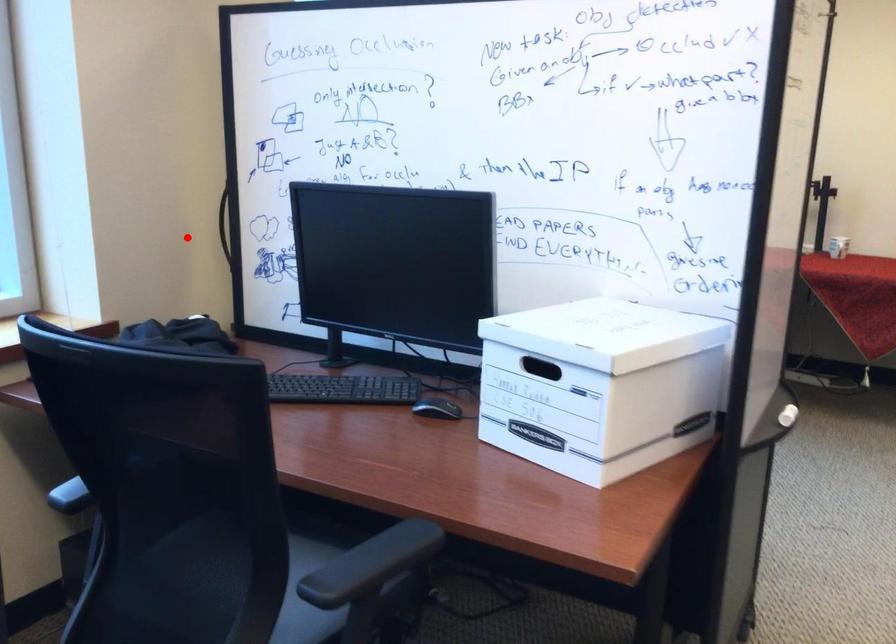
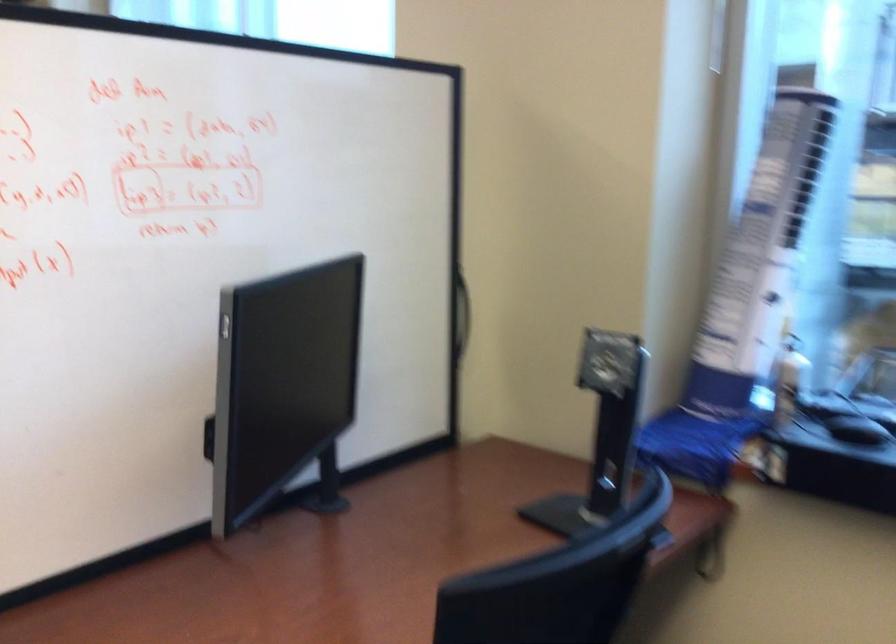
Where in the second image is the point corresponding to the highlighted location from the first image?

(461, 313)